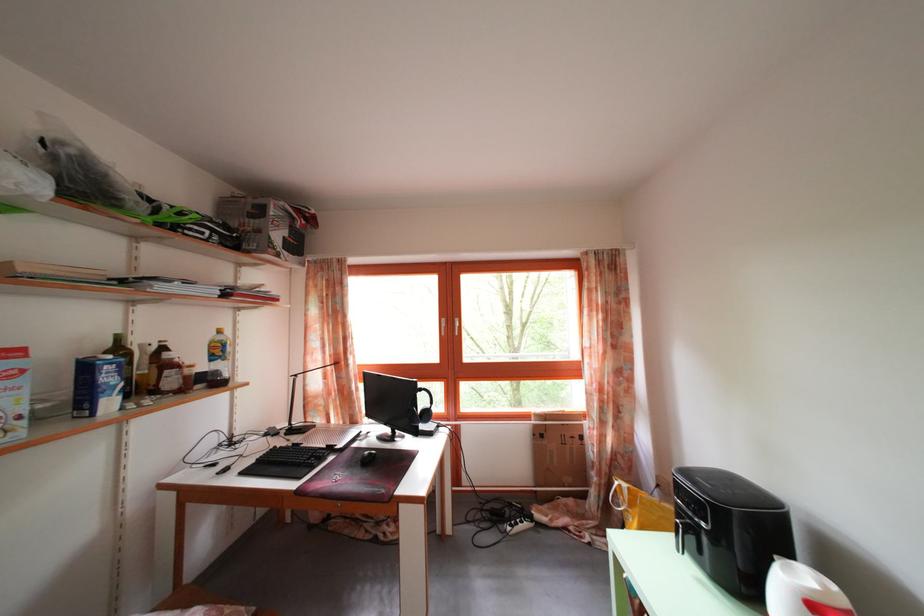
This screenshot has width=924, height=616. Describe the element at coordinates (286, 462) in the screenshot. I see `the black computer keyboard` at that location.